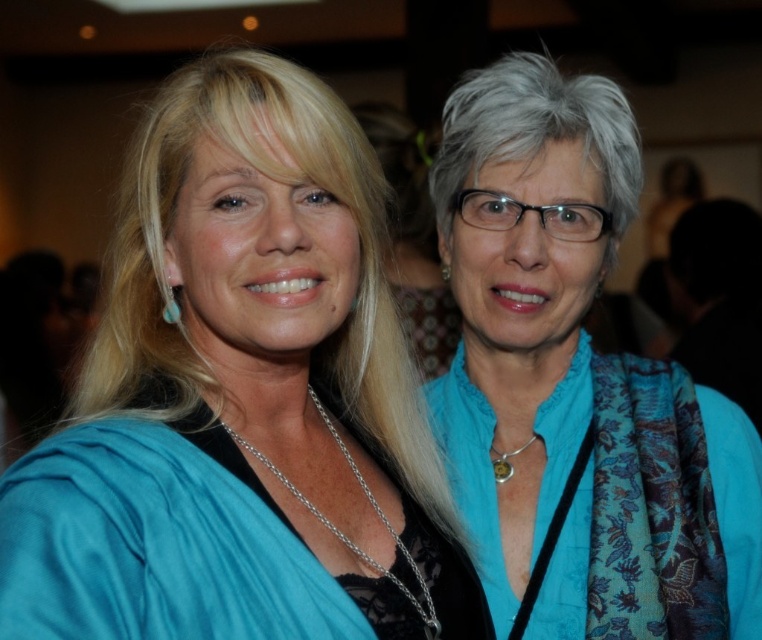
Who is lower down, blue silk blouse at center or teal gemstone earring at upper center?

Positioned lower is blue silk blouse at center.

Is point (303, 556) positioned behind point (440, 266)?

That is False.

I want to click on blue silk blouse at center, so click(242, 400).

Image resolution: width=762 pixels, height=640 pixels. I want to click on blue silk blouse at center, so click(242, 400).

Is blue silk scarf at upper right thinner than teal gemstone earring at upper center?

In fact, blue silk scarf at upper right might be wider than teal gemstone earring at upper center.

Is point (511, 147) farther from viewer compared to point (440, 276)?

No, it is not.

This screenshot has height=640, width=762. Find the location of `blue silk scarf at upper right`. blue silk scarf at upper right is located at coordinates (575, 385).

Is blue silk blouse at center thinner than blue silk scarf at upper right?

Indeed, blue silk blouse at center has a lesser width compared to blue silk scarf at upper right.

Who is more distant from viewer, (x=392, y=525) or (x=458, y=356)?

Positioned behind is point (x=458, y=356).

What do you see at coordinates (242, 400) in the screenshot? Image resolution: width=762 pixels, height=640 pixels. I see `blue silk blouse at center` at bounding box center [242, 400].

Where is `blue silk blouse at center`? blue silk blouse at center is located at coordinates (242, 400).